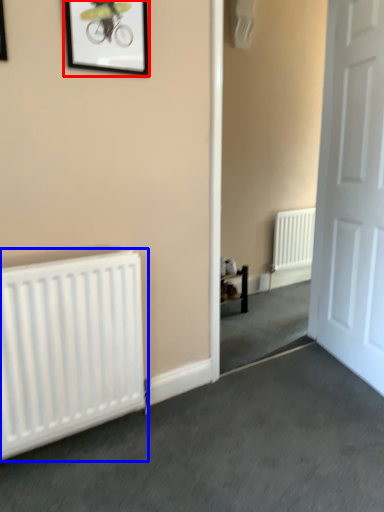
Question: Which object appears farthest to the camera in this image, picture frame (highlighted by a red box) or radiator (highlighted by a blue box)?

Choices:
 (A) picture frame
 (B) radiator

Answer: (A)